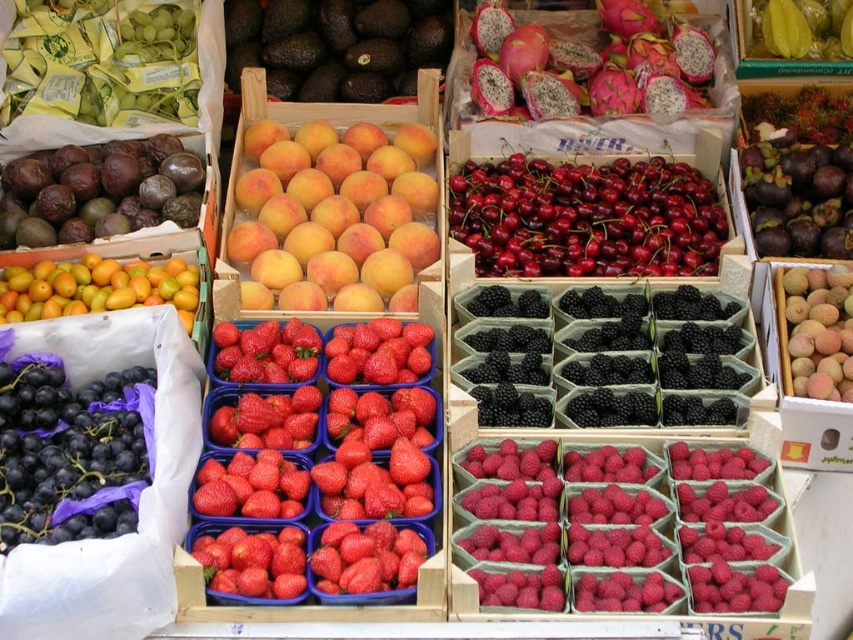
You are a customer at the market stall and want to know which fruit is taller between the shiny red cherries at center and the green matte plum at left. Can you tell me?

The shiny red cherries at center is much taller than the green matte plum at left.

You are a customer at the market stall and want to find the shiny red cherries at center. Based on the coordinates given, where exactly are they located in the image?

The shiny red cherries at center are located at coordinates point 0.341 on the x axis and 0.688 on the y axis.